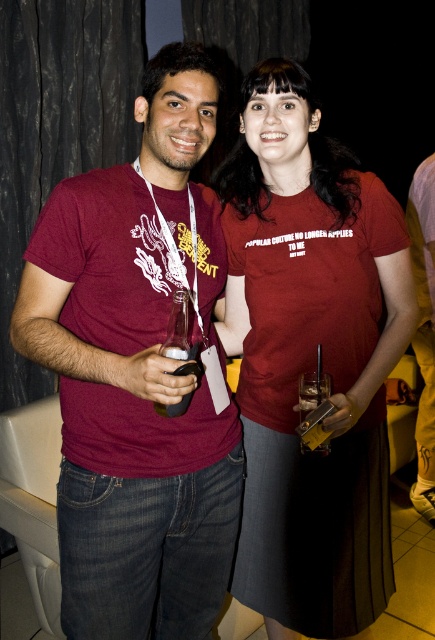
Question: Which object is farther from the camera taking this photo?

Choices:
 (A) clear glass bottle at center
 (B) matte red t-shirt at center

Answer: (B)

Question: Among these points, which one is nearest to the camera?

Choices:
 (A) (257, 508)
 (B) (174, 406)
 (C) (103, 196)

Answer: (B)

Question: From the image, what is the correct spatial relationship of matte red t-shirt at center in relation to clear glass bottle at center?

Choices:
 (A) below
 (B) above

Answer: (A)

Question: Is matte maroon t-shirt at center smaller than matte red t-shirt at center?

Choices:
 (A) no
 (B) yes

Answer: (B)

Question: Can you confirm if matte maroon t-shirt at center is bigger than matte red t-shirt at center?

Choices:
 (A) no
 (B) yes

Answer: (A)

Question: Which of the following is the closest to the observer?

Choices:
 (A) (180, 337)
 (B) (294, 435)
 (C) (226, 444)

Answer: (A)